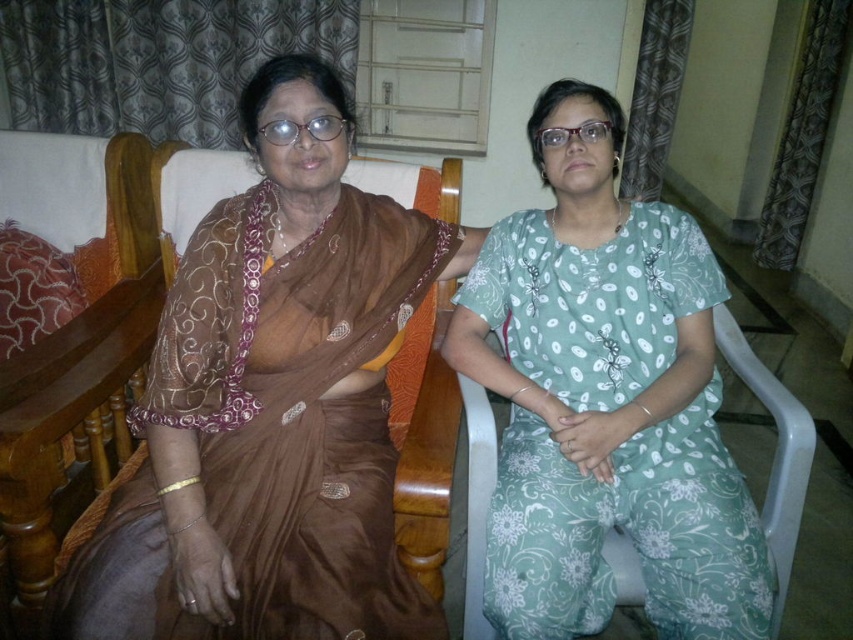
Question: Does brown satin saree at left have a smaller size compared to green floral dress at center?

Choices:
 (A) yes
 (B) no

Answer: (B)

Question: Can you confirm if brown satin saree at left is bigger than green floral dress at center?

Choices:
 (A) yes
 (B) no

Answer: (A)

Question: Which object is closer to the camera taking this photo?

Choices:
 (A) green floral dress at center
 (B) brown satin saree at left

Answer: (B)

Question: Which point is farther to the camera?

Choices:
 (A) (517, 440)
 (B) (363, 241)

Answer: (A)

Question: Among these objects, which one is nearest to the camera?

Choices:
 (A) green floral dress at center
 (B) brown satin saree at left

Answer: (B)

Question: Is brown satin saree at left positioned in front of green floral dress at center?

Choices:
 (A) no
 (B) yes

Answer: (B)